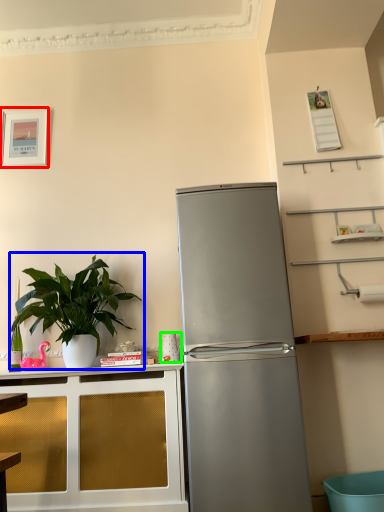
Question: Which object is positioned farthest from picture frame (highlighted by a red box)? Select from houseplant (highlighted by a blue box) and appliance (highlighted by a green box).

Choices:
 (A) houseplant
 (B) appliance

Answer: (B)